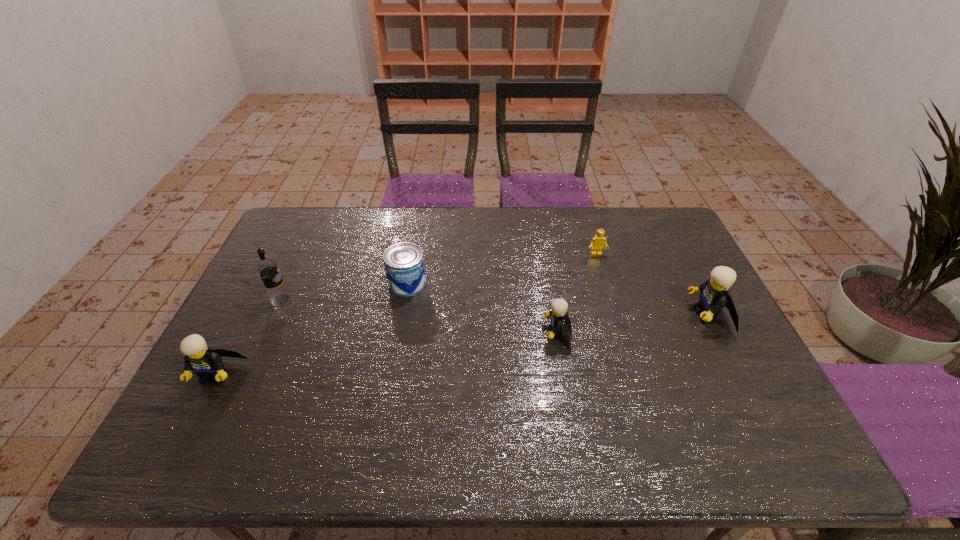
Where is `unoccupied area between the second Lego from left to right and the vodka`? The image size is (960, 540). unoccupied area between the second Lego from left to right and the vodka is located at coordinates (420, 316).

Locate an element on the screen. The height and width of the screenshot is (540, 960). free space between the rightmost object and the farthest object is located at coordinates (652, 285).

Where is `free space between the nearest object and the third object from right to left`? free space between the nearest object and the third object from right to left is located at coordinates click(x=387, y=354).

This screenshot has width=960, height=540. I want to click on vacant region between the vodka and the second shortest Lego, so click(x=420, y=316).

This screenshot has width=960, height=540. Identify the location of unoccupied area between the shortest object and the third Lego from right to left. (577, 294).

Locate an element on the screen. vacant area that lies between the vodka and the second shortest Lego is located at coordinates (420, 316).

At what (x,y) coordinates should I click in order to perform the action: click on free spot between the vodka and the rightmost Lego. Please return your answer as a coordinate pair (x, y). Looking at the image, I should click on (494, 307).

This screenshot has width=960, height=540. Find the location of `free space between the nearest Lego and the third object from left to right`. free space between the nearest Lego and the third object from left to right is located at coordinates (312, 329).

Find the location of `free space between the farthest Lego and the vodka`. free space between the farthest Lego and the vodka is located at coordinates (439, 277).

At what (x,y) coordinates should I click in order to perform the action: click on object that is the fifth closest one to the fifth object from left to right. Please return your answer as a coordinate pair (x, y). Looking at the image, I should click on (206, 362).